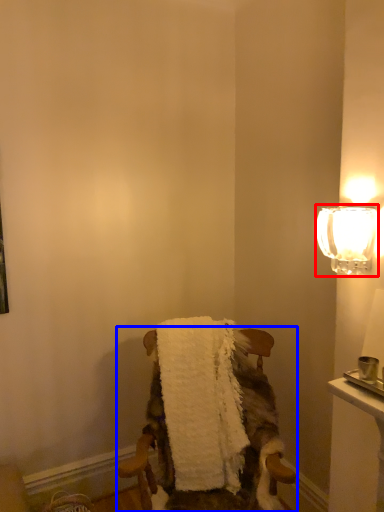
Question: Which object is further to the camera taking this photo, lamp (highlighted by a red box) or chair (highlighted by a blue box)?

Choices:
 (A) lamp
 (B) chair

Answer: (B)